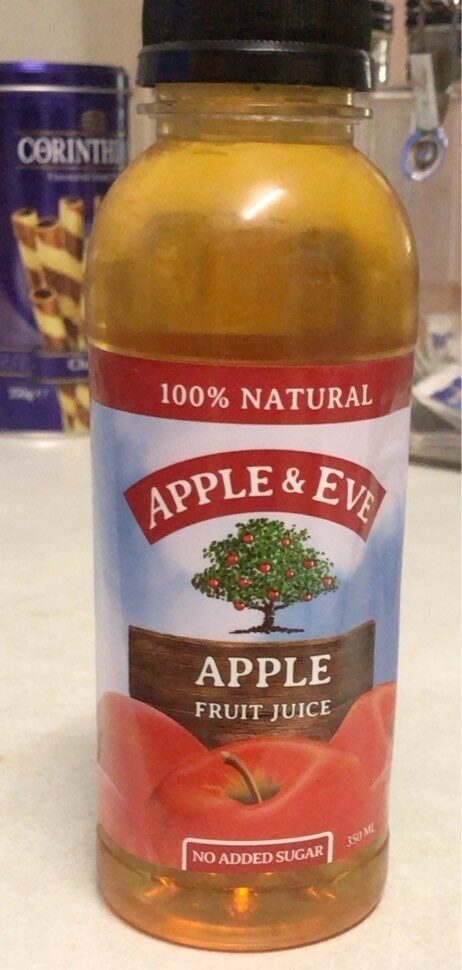
I want to click on cookie tin, so click(x=35, y=182).